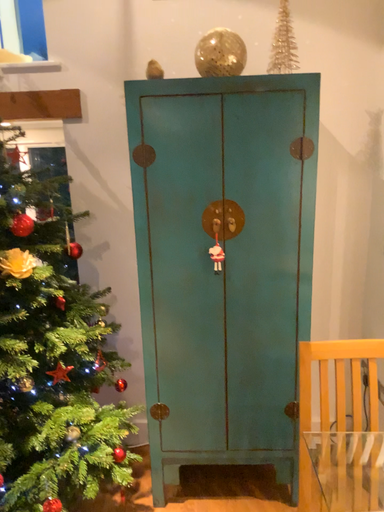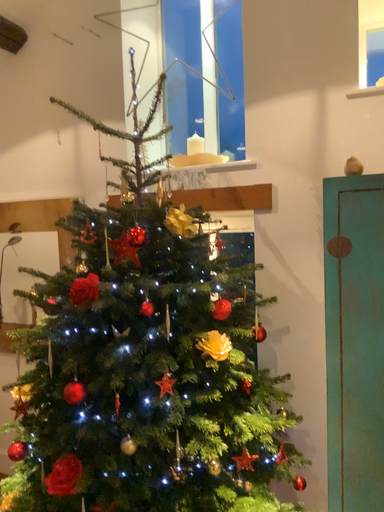
Question: Which way did the camera rotate in the video?

Choices:
 (A) rotated upward
 (B) rotated downward

Answer: (A)